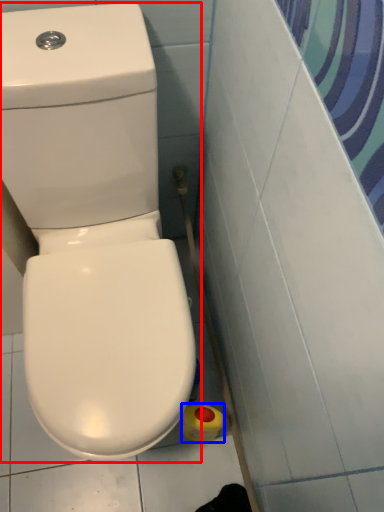
Question: Which point is closer to the camera, toilet (highlighted by a red box) or cleaning product (highlighted by a blue box)?

Choices:
 (A) toilet
 (B) cleaning product

Answer: (A)